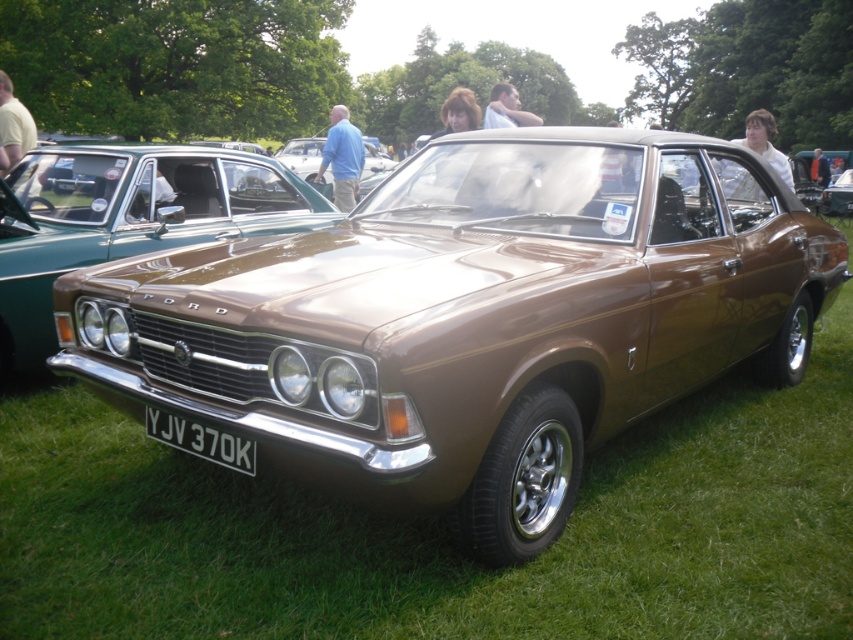
You are a photographer at a car show and want to take a photo of the shiny brown car at center and the brown metallic car at center. Which car should you focus on first if you want to capture the one closer to the front?

The shiny brown car at center is positioned under the brown metallic car at center, so the brown metallic car at center is closer to the front. Focus on the brown metallic car at center first.

You are a photographer standing in front of the brown metallic car at center and the white plastic license plate at center. You want to take a photo that includes both objects but focuses on the license plate. Which object should you move closer to in order to capture the license plate clearly?

To capture the white plastic license plate at center clearly, you should move closer to the brown metallic car at center since it is closer to you than the license plate, allowing you to frame the shot so the license plate is in focus while still including the car in the background.

You are a photographer standing at the center of the grassy area where the shiny brown car at center is parked. You want to take a photo of the car from the front. Which direction should you face to ensure the car is centered in your frame?

Since the shiny brown car at center is located at point coordinates, you should face directly towards the car to center it in your frame.